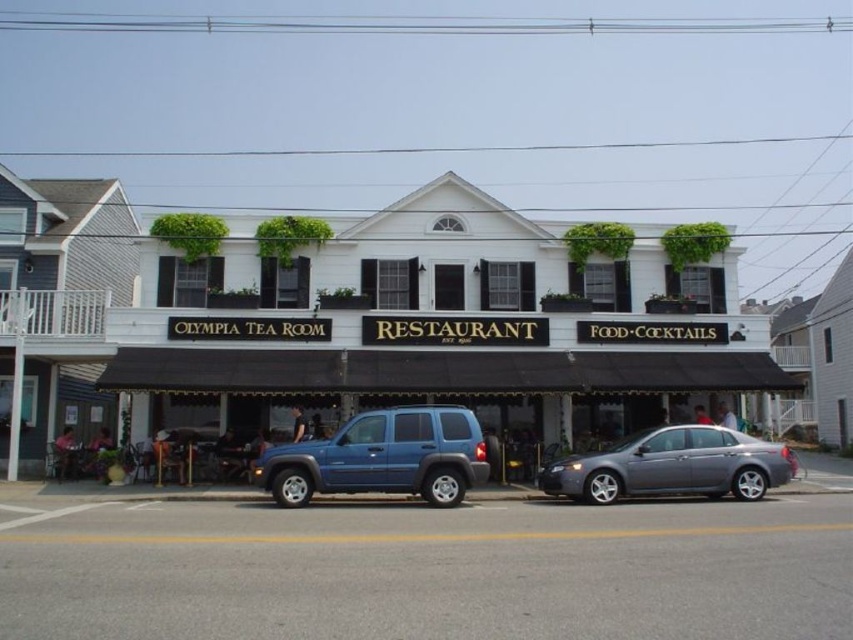
You are a delivery person arriving at the Olympia Tea Room Restaurant. You need to park your vehicle between the blue matte suv at center and the metallic gray sedan at center. Is there enough space between them for your van, which is 2.5 meters wide?

The blue matte suv at center is to the left of the metallic gray sedan at center. Since the distance between them isn

You are a delivery person who needs to park your 6.5 feet tall delivery van. You see the blue matte suv at center and the metallic gray sedan at center parked on the street. Can your van fit between them if the space between them is exactly the same as the height difference between the two vehicles?

The blue matte suv at center is taller than the metallic gray sedan at center. The height difference between them is the SUV being taller, so the space between them would be based on that difference. Since your van is 6.5 feet tall, if the height difference is less than 6.5 feet, the van might not fit. However, without knowing the exact height difference, we can only state the SUV is taller, but cannot confirm the van will fit. Please check the actual space.

You are a delivery person arriving at the Olympia Tea Room Restaurant. You need to park your van, which is 2 meters wide, between the blue matte suv at center and the metallic gray sedan at center. Is there enough space for your van?

The blue matte suv at center is positioned over metallic gray sedan at center, meaning they are parked next to each other. However, since the exact distance between them isn not specified, it is uncertain if there is sufficient space for a 2 meter wide van. Please check the actual spacing before attempting to park.